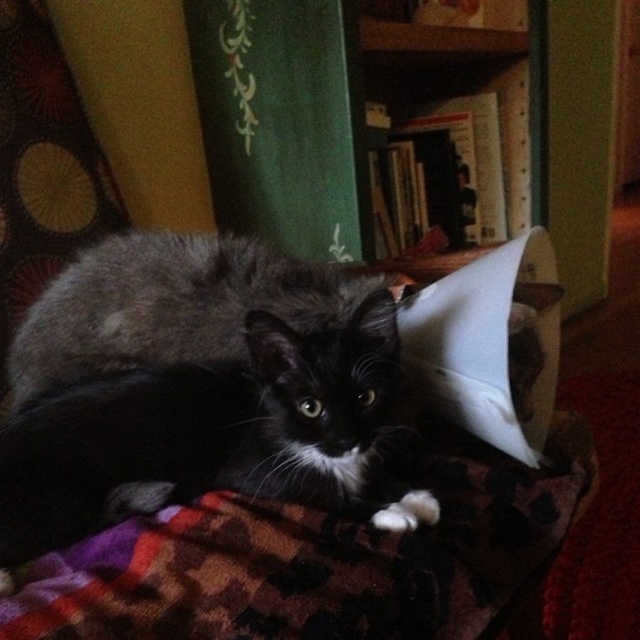
Question: Does black fur cat at center have a larger size compared to fluffy black cat at center?

Choices:
 (A) yes
 (B) no

Answer: (B)

Question: Which of the following is the farthest from the observer?

Choices:
 (A) (132, 420)
 (B) (355, 323)

Answer: (A)

Question: Which object is farther from the camera taking this photo?

Choices:
 (A) fluffy black cat at center
 (B) black fur cat at center

Answer: (A)

Question: Is black fur cat at center below fluffy black cat at center?

Choices:
 (A) yes
 (B) no

Answer: (A)

Question: Can you confirm if black fur cat at center is positioned to the right of fluffy black cat at center?

Choices:
 (A) yes
 (B) no

Answer: (A)